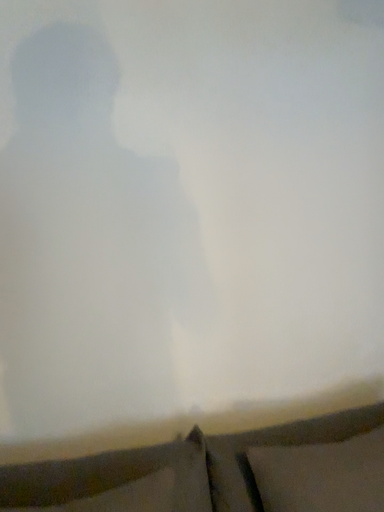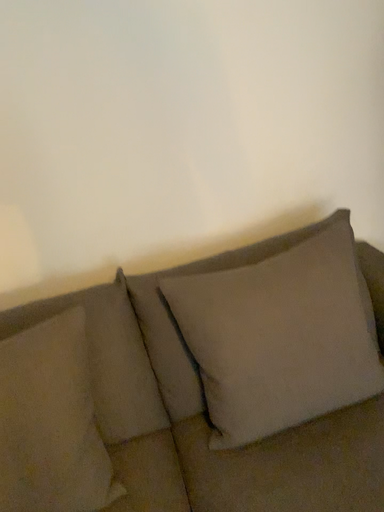
Question: How did the camera likely rotate when shooting the video?

Choices:
 (A) rotated upward
 (B) rotated downward

Answer: (B)